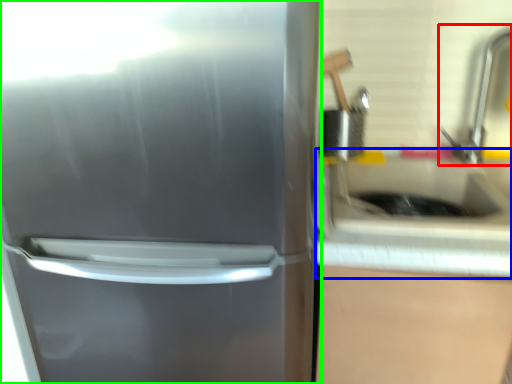
Question: Estimate the real-world distances between objects in this image. Which object is closer to faucet (highlighted by a red box), counter top (highlighted by a blue box) or refrigerator (highlighted by a green box)?

Choices:
 (A) counter top
 (B) refrigerator

Answer: (A)